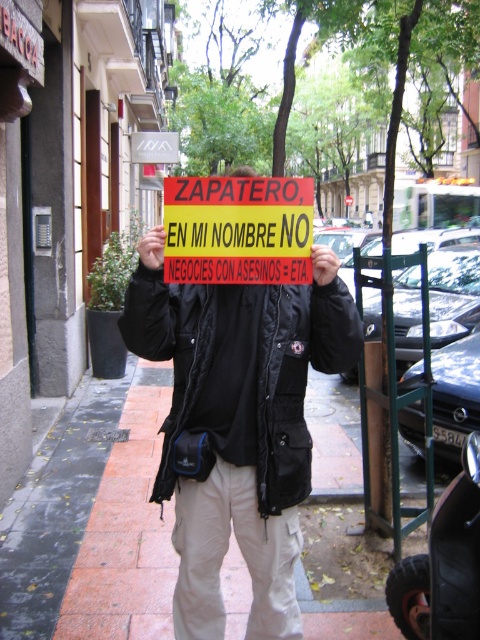
You are a photographer taking a picture of the protest scene. You notice two points in the image at coordinates point [267,310] and point [175,189]. Which point is closer to your camera?

Point [175,189] is closer to the camera because it is less further to the viewer than point [267,310].

You are a photographer trying to capture the protester holding the yellow paper sign at center. Since the black fabric jacket at center is in the way, can you adjust your angle to focus on the sign without the jacket blocking it?

The black fabric jacket at center is located below the yellow paper sign at center, so adjusting the angle upward could allow the photographer to focus on the sign without the jacket blocking it.

You are a photographer trying to capture the person holding the sign. Since the yellow paper sign at center and the black fabric jacket at center are both at the center, which one is closer to the camera?

The black fabric jacket at center is closer to the camera because the yellow paper sign at center is behind it.